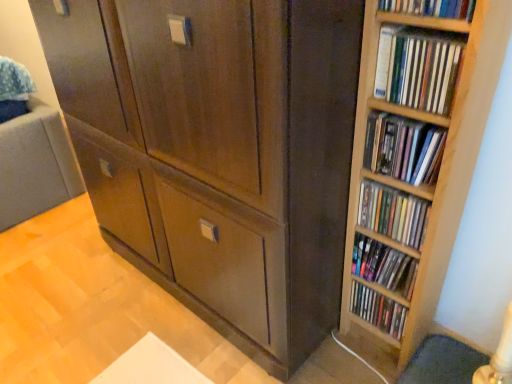
Question: Is wooden bookshelf at right, marked as the 2th book in a top-to-bottom arrangement, oriented towards matte wooden shelf at right, the fifth book from the top?

Choices:
 (A) no
 (B) yes

Answer: (A)

Question: From a real-world perspective, is wooden bookshelf at right, which is the fifth book from bottom to top, over matte wooden shelf at right, the fifth book from the top?

Choices:
 (A) yes
 (B) no

Answer: (A)

Question: From the image's perspective, is wooden bookshelf at right, marked as the 2th book in a top-to-bottom arrangement, located beneath matte wooden shelf at right, the fifth book from the top?

Choices:
 (A) no
 (B) yes

Answer: (A)

Question: Considering the relative positions of wooden bookshelf at right, marked as the 2th book in a top-to-bottom arrangement, and matte wooden shelf at right, positioned as the second book in bottom-to-top order, in the image provided, is wooden bookshelf at right, marked as the 2th book in a top-to-bottom arrangement, to the right of matte wooden shelf at right, positioned as the second book in bottom-to-top order, from the viewer's perspective?

Choices:
 (A) no
 (B) yes

Answer: (A)

Question: Can you confirm if wooden bookshelf at right, marked as the 2th book in a top-to-bottom arrangement, is smaller than matte wooden shelf at right, the fifth book from the top?

Choices:
 (A) no
 (B) yes

Answer: (B)

Question: Considering the positions of matte wooden shelf at right, positioned as the second book in bottom-to-top order, and wooden bookshelf at right, marked as the 2th book in a top-to-bottom arrangement, in the image, is matte wooden shelf at right, positioned as the second book in bottom-to-top order, taller or shorter than wooden bookshelf at right, marked as the 2th book in a top-to-bottom arrangement,?

Choices:
 (A) tall
 (B) short

Answer: (A)

Question: From the image's perspective, is matte wooden shelf at right, positioned as the second book in bottom-to-top order, located above or below wooden bookshelf at right, marked as the 2th book in a top-to-bottom arrangement?

Choices:
 (A) above
 (B) below

Answer: (B)

Question: Does point (397, 281) appear closer or farther from the camera than point (379, 46)?

Choices:
 (A) closer
 (B) farther

Answer: (B)

Question: From a real-world perspective, is matte wooden shelf at right, the fifth book from the top, positioned above or below wooden bookshelf at right, marked as the 2th book in a top-to-bottom arrangement?

Choices:
 (A) below
 (B) above

Answer: (A)

Question: Does point (380, 127) appear closer or farther from the camera than point (471, 6)?

Choices:
 (A) closer
 (B) farther

Answer: (B)

Question: Considering their positions, is wooden bookshelf at right, the fourth book positioned from the bottom, located in front of or behind wooden bookshelf at upper right, the sixth book positioned from the bottom?

Choices:
 (A) front
 (B) behind

Answer: (B)

Question: Considering the relative positions of wooden bookshelf at right, the 3th book from the top, and wooden bookshelf at upper right, arranged as the 1th book when viewed from the top, in the image provided, is wooden bookshelf at right, the 3th book from the top, to the left or to the right of wooden bookshelf at upper right, arranged as the 1th book when viewed from the top,?

Choices:
 (A) left
 (B) right

Answer: (B)

Question: From the image's perspective, is wooden bookshelf at right, the fourth book positioned from the bottom, above or below wooden bookshelf at upper right, arranged as the 1th book when viewed from the top?

Choices:
 (A) above
 (B) below

Answer: (B)

Question: Is point (391, 8) positioned closer to the camera than point (389, 82)?

Choices:
 (A) farther
 (B) closer

Answer: (B)

Question: Based on their sizes in the image, would you say wooden bookshelf at upper right, the sixth book positioned from the bottom, is bigger or smaller than wooden bookshelf at right, marked as the 2th book in a top-to-bottom arrangement?

Choices:
 (A) small
 (B) big

Answer: (B)